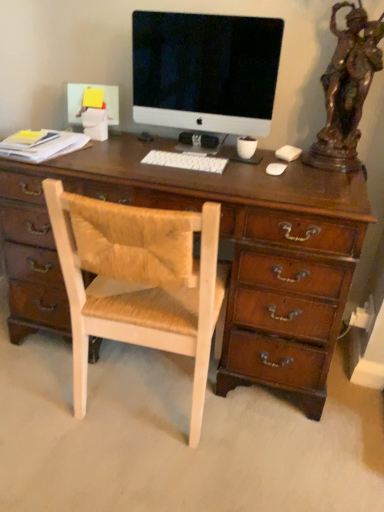
Question: Can you confirm if satin black monitor at center is wider than bronze statue at right?

Choices:
 (A) no
 (B) yes

Answer: (A)

Question: Would you say satin black monitor at center is a long distance from bronze statue at right?

Choices:
 (A) no
 (B) yes

Answer: (A)

Question: Does satin black monitor at center appear on the left side of bronze statue at right?

Choices:
 (A) yes
 (B) no

Answer: (A)

Question: From the image's perspective, would you say satin black monitor at center is shown under bronze statue at right?

Choices:
 (A) no
 (B) yes

Answer: (A)

Question: Would you say satin black monitor at center contains bronze statue at right?

Choices:
 (A) no
 (B) yes

Answer: (A)

Question: Does satin black monitor at center have a smaller size compared to bronze statue at right?

Choices:
 (A) no
 (B) yes

Answer: (B)

Question: From the image's perspective, is white plastic keyboard at center on top of bronze statue at right?

Choices:
 (A) yes
 (B) no

Answer: (B)

Question: Is white plastic keyboard at center turned away from bronze statue at right?

Choices:
 (A) no
 (B) yes

Answer: (A)

Question: Does white plastic keyboard at center have a greater width compared to bronze statue at right?

Choices:
 (A) yes
 (B) no

Answer: (B)

Question: Considering the relative positions of white plastic keyboard at center and bronze statue at right in the image provided, is white plastic keyboard at center in front of bronze statue at right?

Choices:
 (A) yes
 (B) no

Answer: (B)

Question: Would you say white plastic keyboard at center contains bronze statue at right?

Choices:
 (A) no
 (B) yes

Answer: (A)

Question: Considering the relative sizes of white plastic keyboard at center and bronze statue at right in the image provided, is white plastic keyboard at center smaller than bronze statue at right?

Choices:
 (A) no
 (B) yes

Answer: (B)

Question: Can you confirm if satin black monitor at center is shorter than white plastic keyboard at center?

Choices:
 (A) yes
 (B) no

Answer: (B)